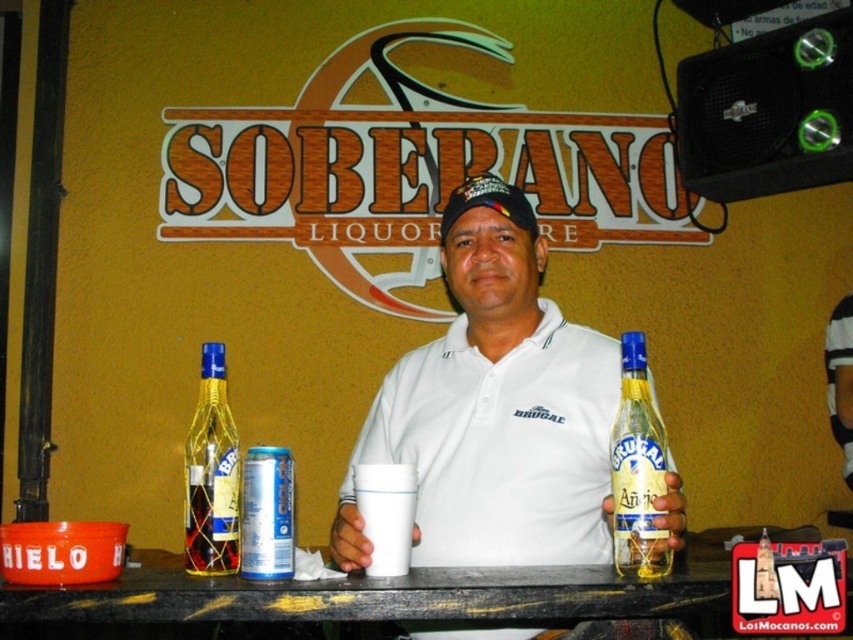
Who is positioned more to the right, black matte table at center or translucent glass bottle at left?

From the viewer's perspective, black matte table at center appears more on the right side.

Who is more distant from viewer, (621, 611) or (193, 484)?

Point (193, 484)

This screenshot has height=640, width=853. In order to click on black matte table at center in this screenshot , I will do `click(376, 596)`.

Can you confirm if white matte shirt at center is positioned to the left of translucent glass bottle at left?

In fact, white matte shirt at center is to the right of translucent glass bottle at left.

At what (x,y) coordinates should I click in order to perform the action: click on white matte shirt at center. Please return your answer as a coordinate pair (x, y). The image size is (853, 640). Looking at the image, I should click on (495, 408).

Locate an element on the screen. Image resolution: width=853 pixels, height=640 pixels. white matte shirt at center is located at coordinates (495, 408).

Is point (660, 509) behind point (201, 492)?

That is False.

Is translucent glass bottle at center wider than translucent glass bottle at left?

In fact, translucent glass bottle at center might be narrower than translucent glass bottle at left.

Between point (641, 396) and point (213, 388), which one is positioned in front?

Point (641, 396) is in front.

Identify the location of translucent glass bottle at center. This screenshot has width=853, height=640. (637, 472).